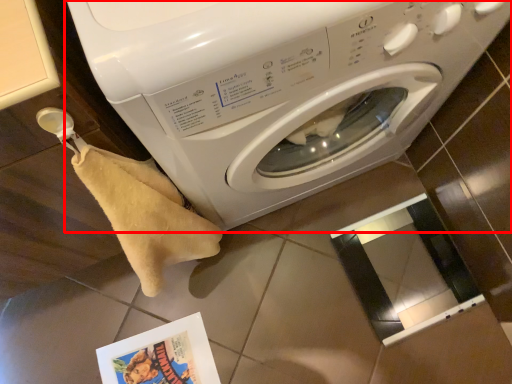
Question: From the image's perspective, where is washing machine (annotated by the red box) located relative to comic book?

Choices:
 (A) below
 (B) above

Answer: (B)